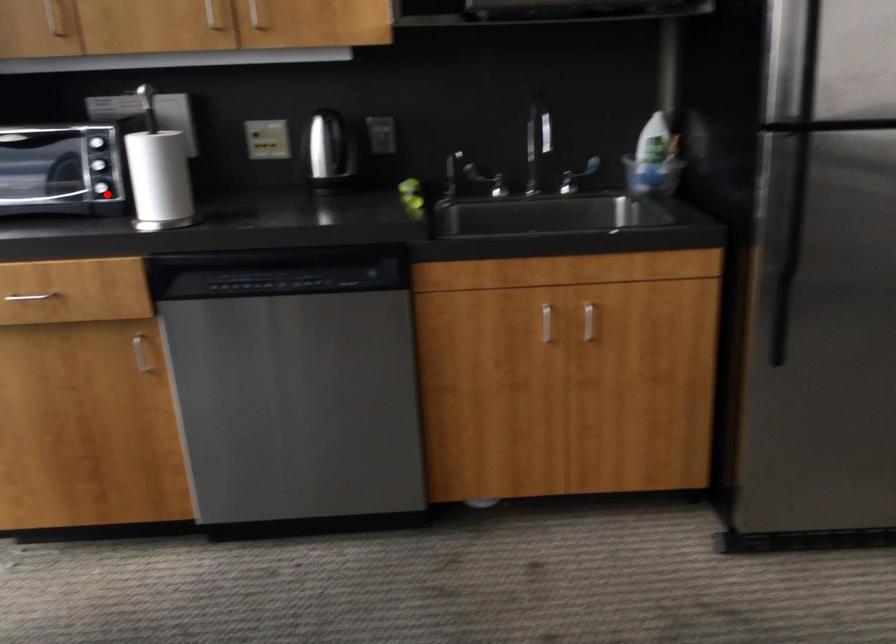
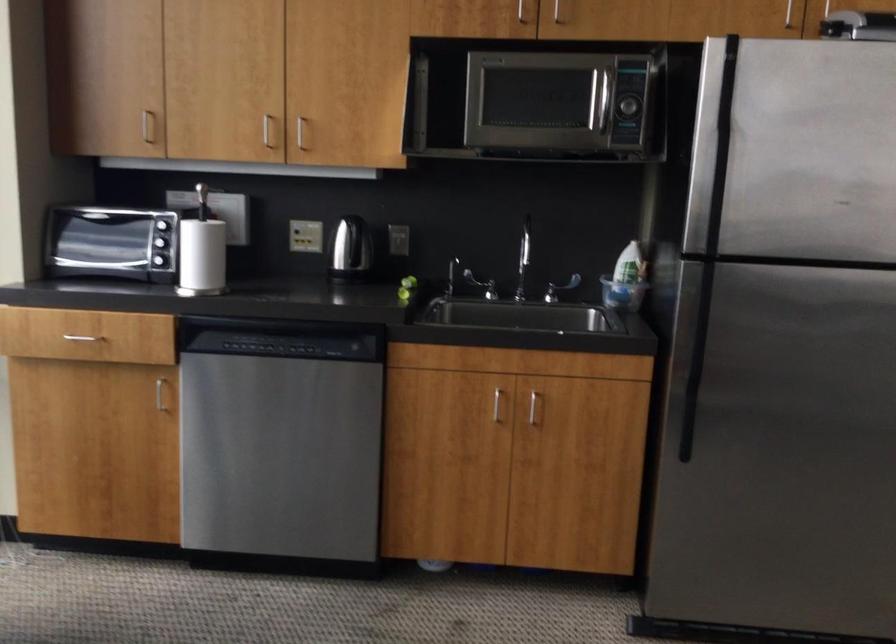
Locate, in the second image, the point that corresponds to the highlighted location in the first image.

(159, 263)